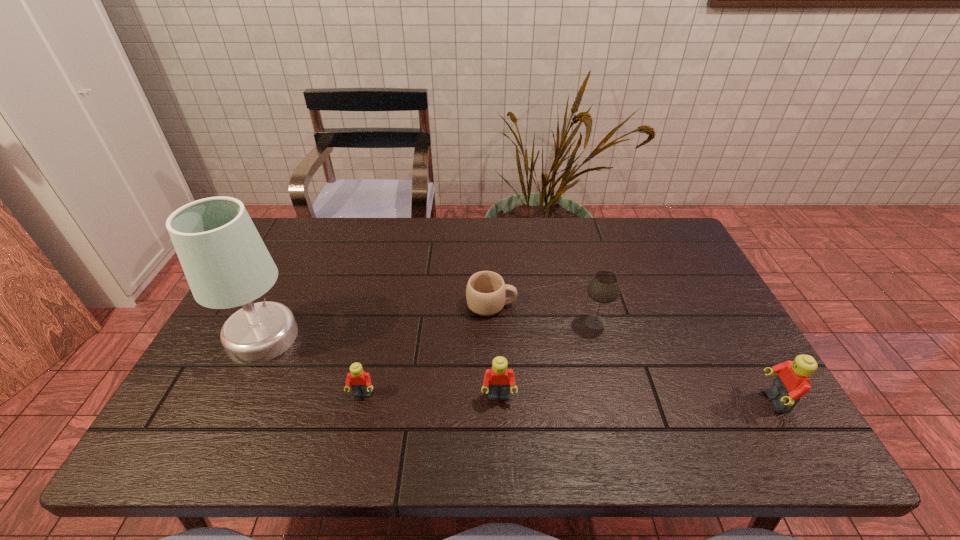
Identify the location of the leftmost Lego. (360, 381).

At what (x,y) coordinates should I click in order to perform the action: click on the second object from left to right. Please return your answer as a coordinate pair (x, y). The height and width of the screenshot is (540, 960). Looking at the image, I should click on [x=360, y=381].

Locate an element on the screen. This screenshot has height=540, width=960. the second Lego from right to left is located at coordinates (498, 379).

I want to click on the fourth tallest object, so click(x=498, y=379).

I want to click on the rightmost object, so click(792, 382).

Locate an element on the screen. The image size is (960, 540). the rightmost Lego is located at coordinates (792, 382).

You are a GUI agent. You are given a task and a screenshot of the screen. Output one action in this format:
    pyautogui.click(x=<x>, y=<y>)
    Task: Click on the mug
    The height and width of the screenshot is (540, 960).
    Given the screenshot: What is the action you would take?
    pyautogui.click(x=486, y=291)

I want to click on lampshade, so click(x=226, y=263).

You are a GUI agent. You are given a task and a screenshot of the screen. Output one action in this format:
    pyautogui.click(x=<x>, y=<y>)
    Task: Click on the tallest object
    This screenshot has height=540, width=960.
    Given the screenshot: What is the action you would take?
    pyautogui.click(x=226, y=263)

You are a GUI agent. You are given a task and a screenshot of the screen. Output one action in this format:
    pyautogui.click(x=<x>, y=<y>)
    Task: Click on the second object from right to left
    The image size is (960, 540).
    Given the screenshot: What is the action you would take?
    tap(604, 288)